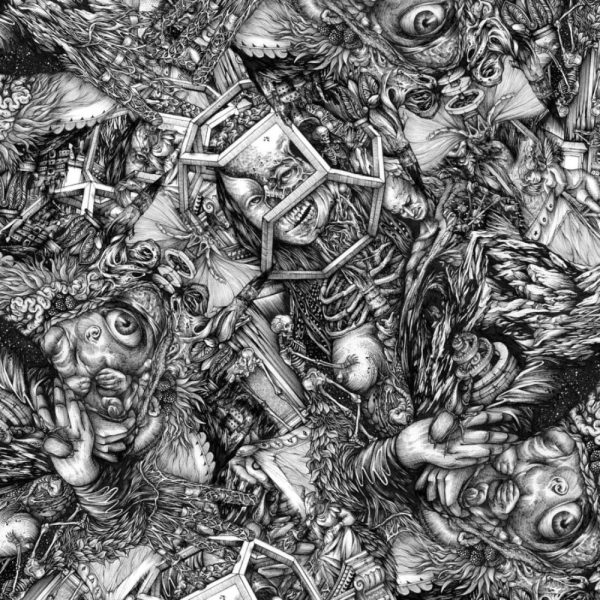
Where is `cornice`? This screenshot has height=600, width=600. cornice is located at coordinates (366, 575).